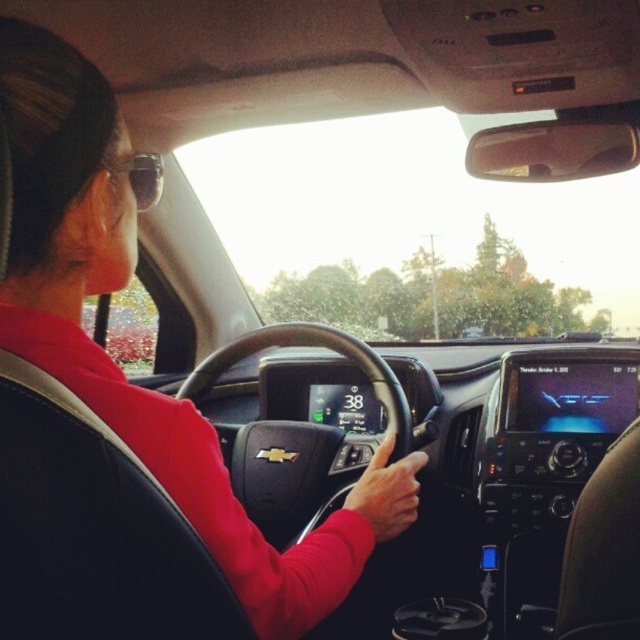
Can you confirm if black leather steering wheel at center is wider than sunglasses at upper left?

Correct, the width of black leather steering wheel at center exceeds that of sunglasses at upper left.

What do you see at coordinates (282, 472) in the screenshot?
I see `black leather steering wheel at center` at bounding box center [282, 472].

This screenshot has width=640, height=640. Describe the element at coordinates (282, 472) in the screenshot. I see `black leather steering wheel at center` at that location.

In order to click on black leather steering wheel at center in this screenshot , I will do `click(282, 472)`.